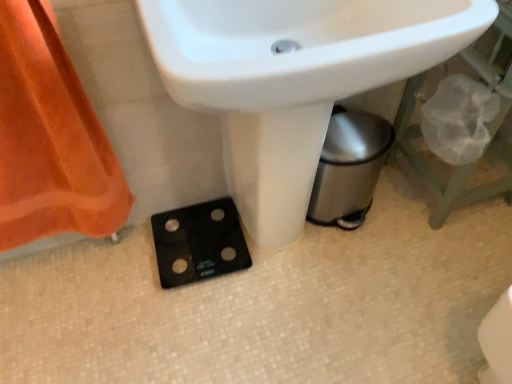
Question: Considering their positions, is orange fabric at left located in front of or behind white glossy sink at center?

Choices:
 (A) behind
 (B) front

Answer: (A)

Question: Considering the positions of orange fabric at left and white glossy sink at center in the image, is orange fabric at left taller or shorter than white glossy sink at center?

Choices:
 (A) short
 (B) tall

Answer: (A)

Question: Estimate the real-world distances between objects in this image. Which object is farther from the black glass scale at lower center?

Choices:
 (A) orange fabric at left
 (B) white glossy sink at center

Answer: (B)

Question: Estimate the real-world distances between objects in this image. Which object is farther from the black glass scale at lower center?

Choices:
 (A) white glossy sink at center
 (B) orange fabric at left

Answer: (A)